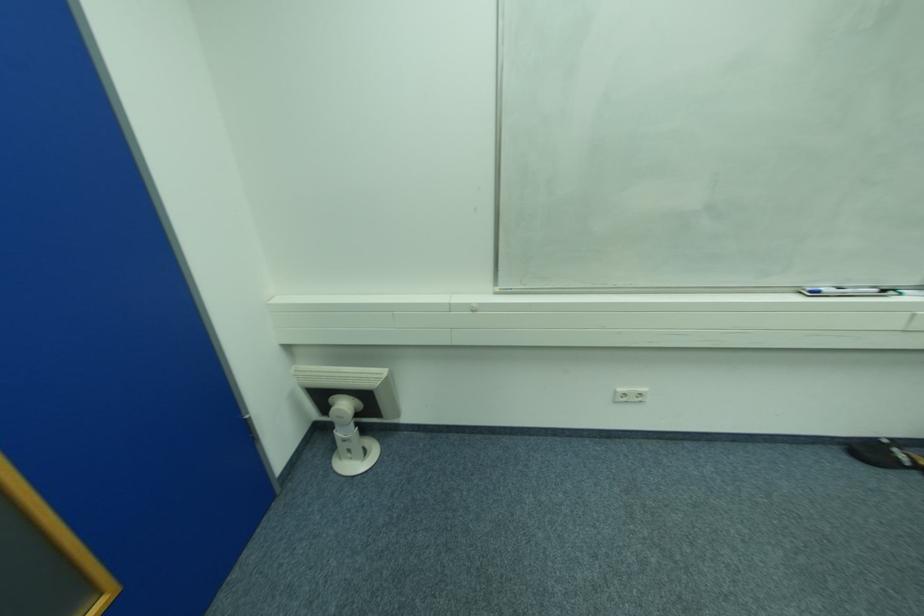
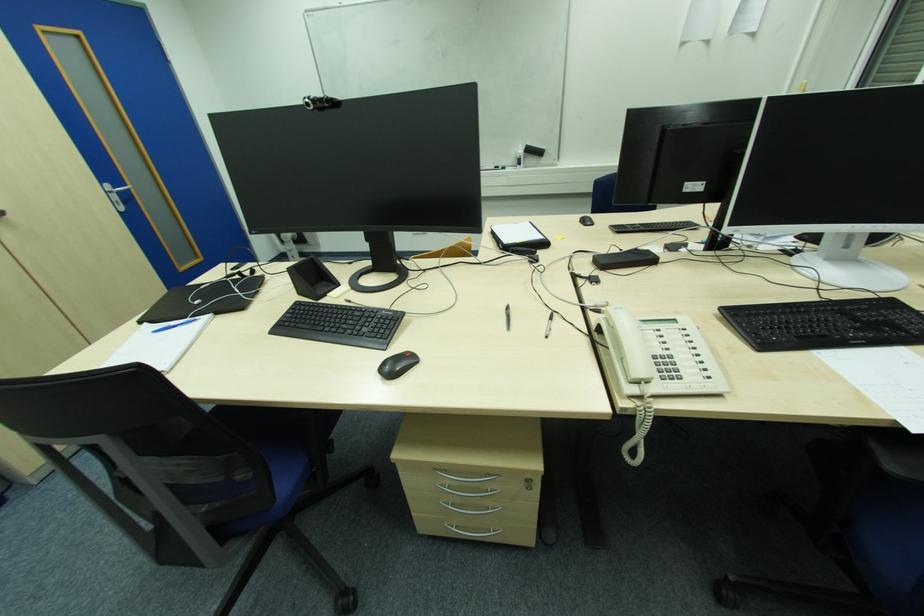
In a continuous first-person perspective shot, in which direction is the camera moving?

The movement direction of the cameraman is right, backward.